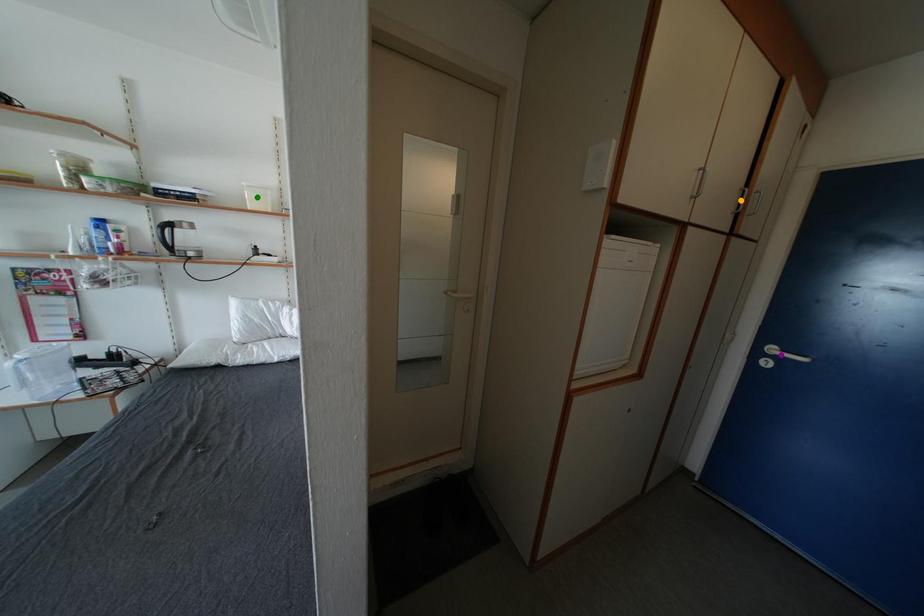
Order these from nearest to farthest:
purple point
green point
orange point

1. green point
2. purple point
3. orange point